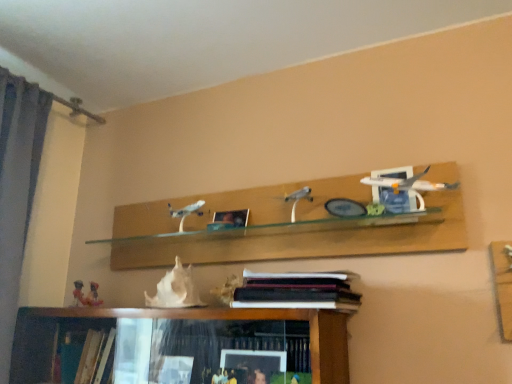
Question: Considering the positions of hardcover books at center and metallic silver picture frame at center in the image, is hardcover books at center bigger or smaller than metallic silver picture frame at center?

Choices:
 (A) small
 (B) big

Answer: (B)

Question: Considering their positions, is hardcover books at center located in front of or behind metallic silver picture frame at center?

Choices:
 (A) behind
 (B) front

Answer: (B)

Question: Which of these objects is positioned farthest from the hardcover books at center?

Choices:
 (A) white glossy airplane at upper right
 (B) white matte seashell at center
 (C) metallic silver picture frame at center

Answer: (C)

Question: Based on their relative distances, which object is farther from the white glossy airplane at upper right?

Choices:
 (A) hardcover books at center
 (B) white matte seashell at center
 (C) metallic silver picture frame at center

Answer: (B)